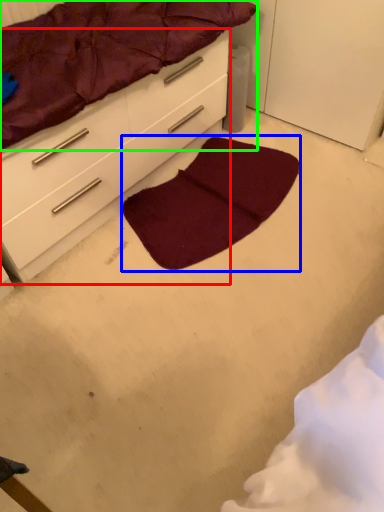
Question: Which is nearer to the chest of drawers (highlighted by a red box)? mat (highlighted by a blue box) or mattress (highlighted by a green box).

Choices:
 (A) mat
 (B) mattress

Answer: (B)